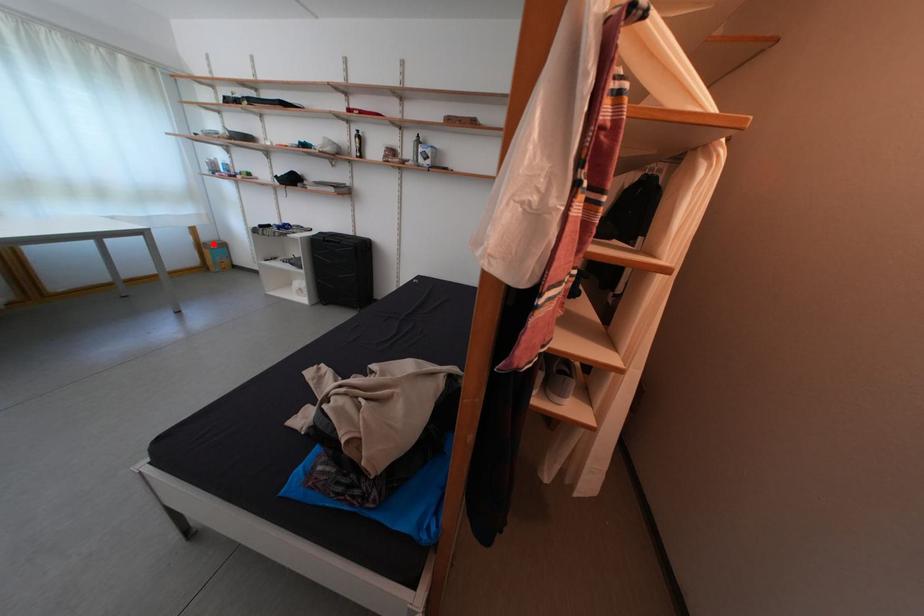
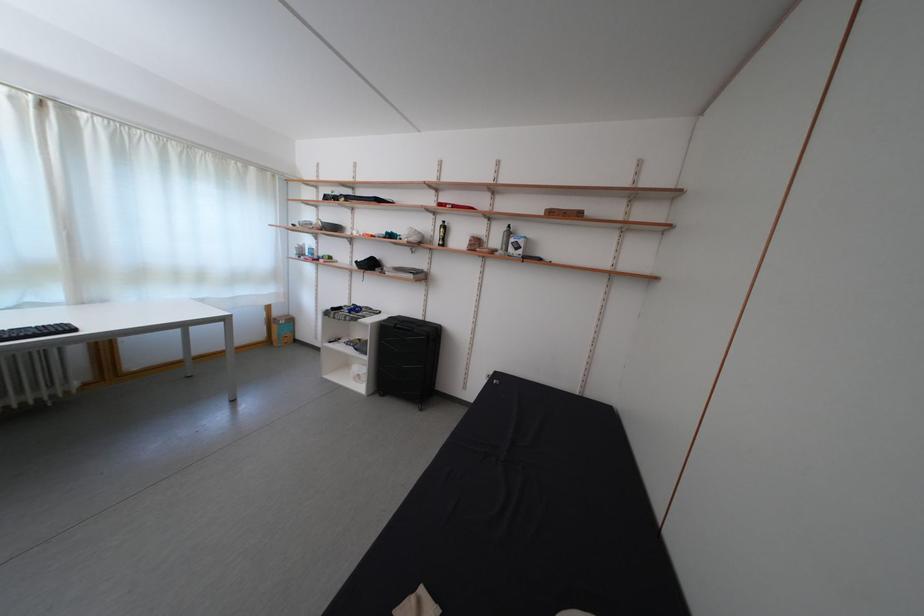
Question: I am providing you with two images of the same scene from different viewpoints. A red point is shown in image1. For the corresponding object point in image2, is it positioned nearer or farther from the camera?

Choices:
 (A) Nearer
 (B) Farther

Answer: (B)